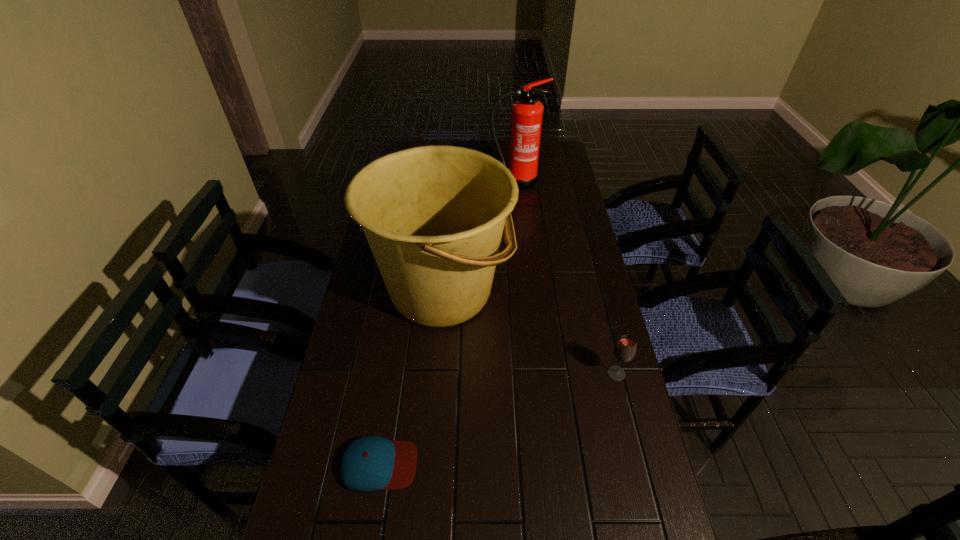
This screenshot has width=960, height=540. What are the coordinates of `the farthest object` in the screenshot? It's located at (527, 113).

Find the location of a particular element. This screenshot has width=960, height=540. the third nearest object is located at coordinates (433, 216).

Locate an element on the screen. the rightmost object is located at coordinates (625, 349).

At what (x,y) coordinates should I click in order to perform the action: click on the third farthest object. Please return your answer as a coordinate pair (x, y). This screenshot has height=540, width=960. Looking at the image, I should click on (625, 349).

Locate an element on the screen. the shortest object is located at coordinates (369, 463).

At what (x,y) coordinates should I click in order to perform the action: click on the nearest object. Please return your answer as a coordinate pair (x, y). Image resolution: width=960 pixels, height=540 pixels. Looking at the image, I should click on (369, 463).

Identify the location of vacant space situated at the nozzle of the farthest object. (520, 228).

Find the location of a particular element. The image size is (960, 540). free spot located 0.210m on the side of the third nearest object with the handle is located at coordinates (577, 291).

The width and height of the screenshot is (960, 540). In order to click on free space located 0.200m on the back of the second nearest object in this screenshot , I will do `click(600, 310)`.

Locate an element on the screen. The image size is (960, 540). free region located 0.050m with the bill of the baseball cap facing forward is located at coordinates (439, 464).